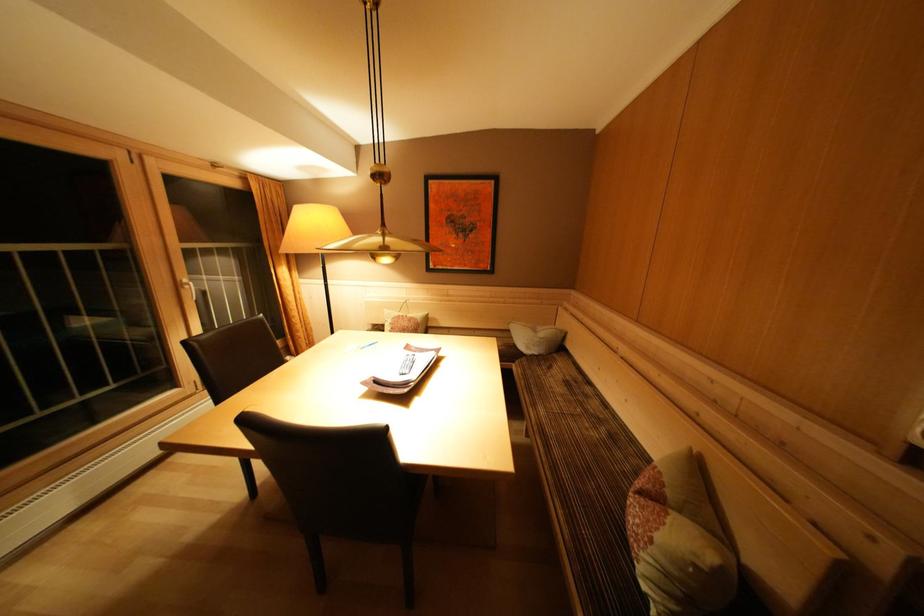
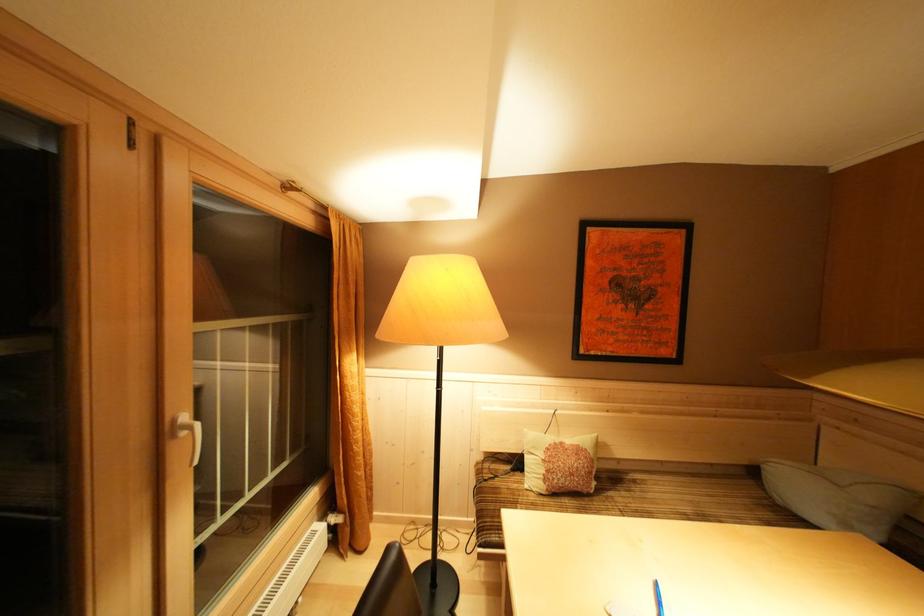
In a continuous first-person perspective shot, in which direction is the camera moving?

The cameraman moved toward left, forward.